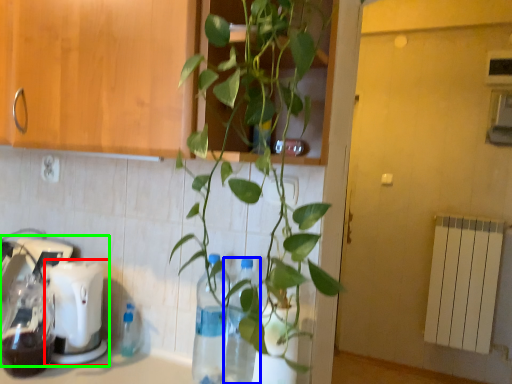
Question: Which is farther away from coffee machine (highlighted by a red box)? glass bottle (highlighted by a blue box) or mixer (highlighted by a green box)?

Choices:
 (A) glass bottle
 (B) mixer

Answer: (A)